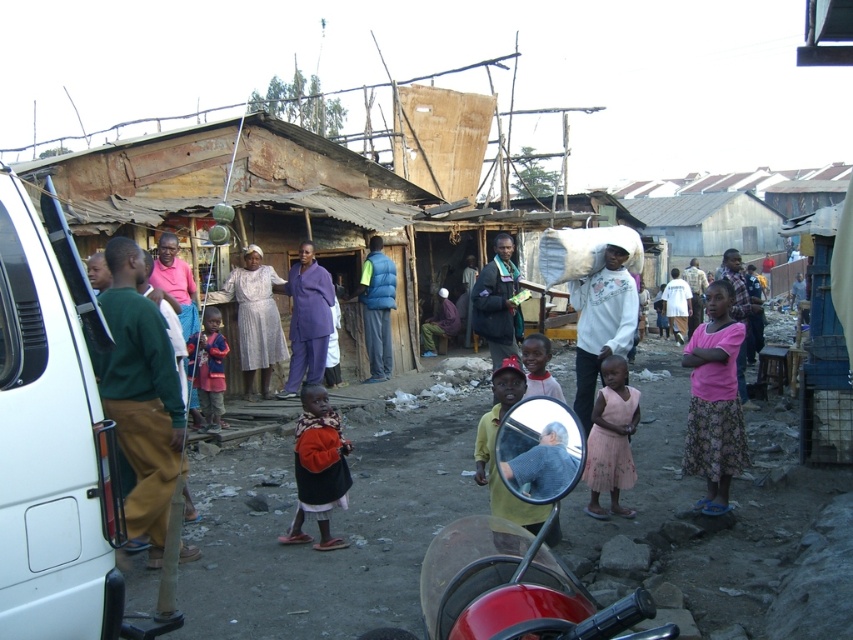
Does pink fabric skirt at center-right have a smaller size compared to blue down jacket at center?

Yes, pink fabric skirt at center-right is smaller than blue down jacket at center.

The height and width of the screenshot is (640, 853). Describe the element at coordinates (714, 401) in the screenshot. I see `pink fabric skirt at center-right` at that location.

Who is more distant from viewer, [711,362] or [389,285]?

Point [389,285]

Identify the location of pink fabric skirt at center-right. (714, 401).

Is white cotton sweatshirt at center smaller than blue down jacket at center?

Yes, white cotton sweatshirt at center is smaller than blue down jacket at center.

Does point (602, 260) come closer to viewer compared to point (387, 349)?

Yes.

This screenshot has width=853, height=640. Find the location of `white cotton sweatshirt at center`. white cotton sweatshirt at center is located at coordinates (601, 323).

Between green cotton sweater at left and purple fabric at center, which one is positioned lower?

green cotton sweater at left

Does green cotton sweater at left have a larger size compared to purple fabric at center?

Yes.

Image resolution: width=853 pixels, height=640 pixels. Describe the element at coordinates (141, 394) in the screenshot. I see `green cotton sweater at left` at that location.

Find the location of a particular element. The image size is (853, 640). green cotton sweater at left is located at coordinates (141, 394).